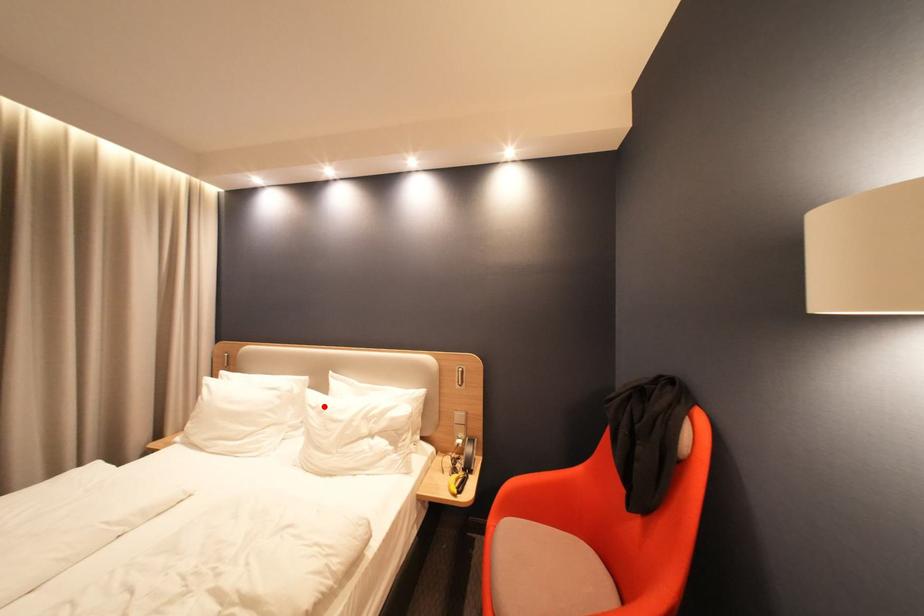
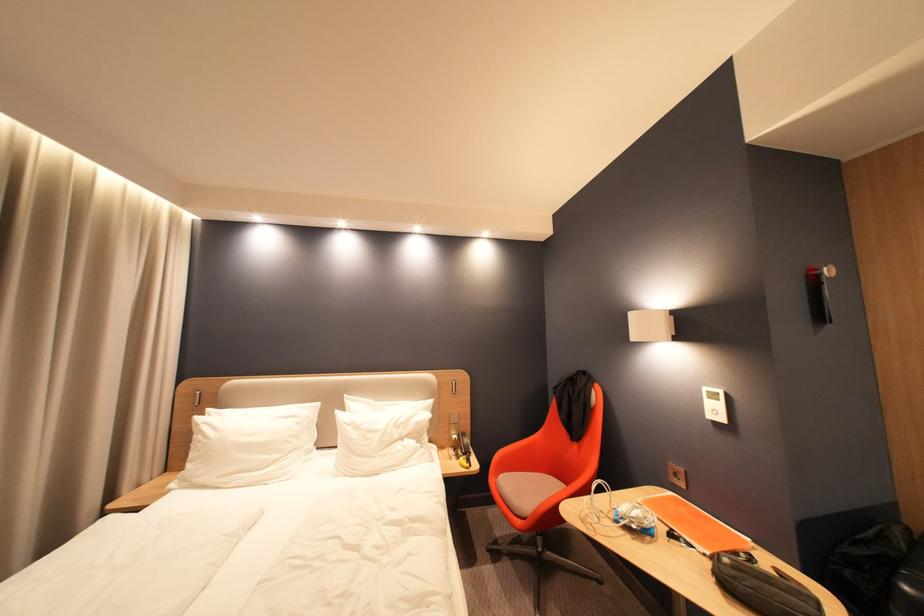
Where in the second image is the point corresponding to the highlighted location from the first image?

(359, 424)